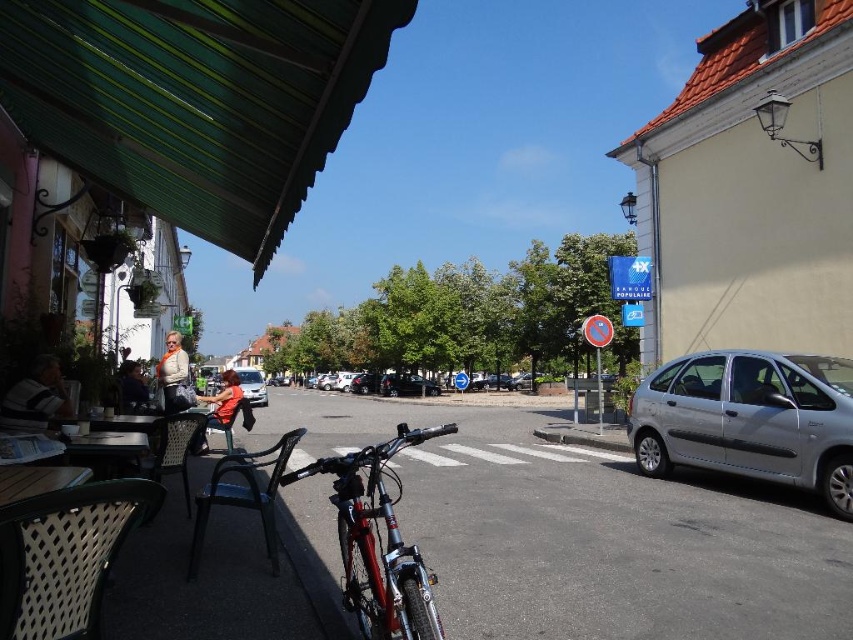
You are a photographer taking a picture of the striped shirt at left and the orange fabric shirt at center in the town scene. Which shirt should you focus on first if you want to capture both in one frame without moving the camera?

You should focus on the orange fabric shirt at center first because it is taller than the striped shirt at left, making it more prominent in the frame.

You are a delivery person who needs to park your 1.8 meter wide delivery van between the silver metallic hatchback at right and the orange fabric shirt at center. Can you fit your van in the space between them?

The silver metallic hatchback at right is narrower than the orange fabric shirt at center. However, the description only provides information about their widths relative to each other, not the actual space between them. Without knowing the distance between the two objects, it is impossible to determine if the van will fit.

You are a delivery driver who needs to park your car in the parking lot behind the silver metallic hatchback at right. The parking spot is 6 meters long. Can you safely park your car there?

The silver metallic hatchback at right is 6.47 meters from the camera, so the parking spot is 6 meters long. Since the car is longer than the parking spot, you cannot safely park there.